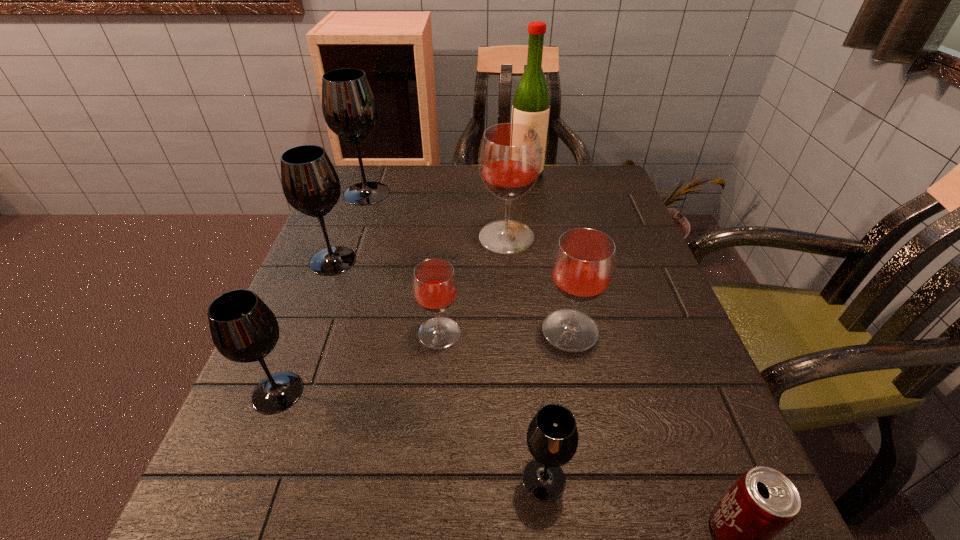
This screenshot has height=540, width=960. Identify the location of vacant area situated on the back of the smallest gray wineglass. (538, 420).

Find the location of a particular element. This screenshot has width=960, height=540. liquor present at the far edge is located at coordinates (x=531, y=104).

The width and height of the screenshot is (960, 540). I want to click on wineglass that is at the far edge, so (350, 109).

Find the location of a particular element. The width and height of the screenshot is (960, 540). object located in the near edge section of the desktop is located at coordinates (552, 437).

In order to click on object that is at the right edge in this screenshot , I will do `click(583, 265)`.

At what (x,y) coordinates should I click in order to perform the action: click on object that is at the far left corner. Please return your answer as a coordinate pair (x, y). Looking at the image, I should click on (350, 109).

The image size is (960, 540). Find the location of `vacant region at the far edge of the desktop`. vacant region at the far edge of the desktop is located at coordinates (476, 184).

Image resolution: width=960 pixels, height=540 pixels. In the image, there is a desktop. Find the location of `vacant space at the left edge`. vacant space at the left edge is located at coordinates (304, 431).

In the image, there is a desktop. What are the coordinates of `vacant space at the right edge` in the screenshot? It's located at (570, 220).

In order to click on vacant space at the far left corner in this screenshot , I will do `click(381, 167)`.